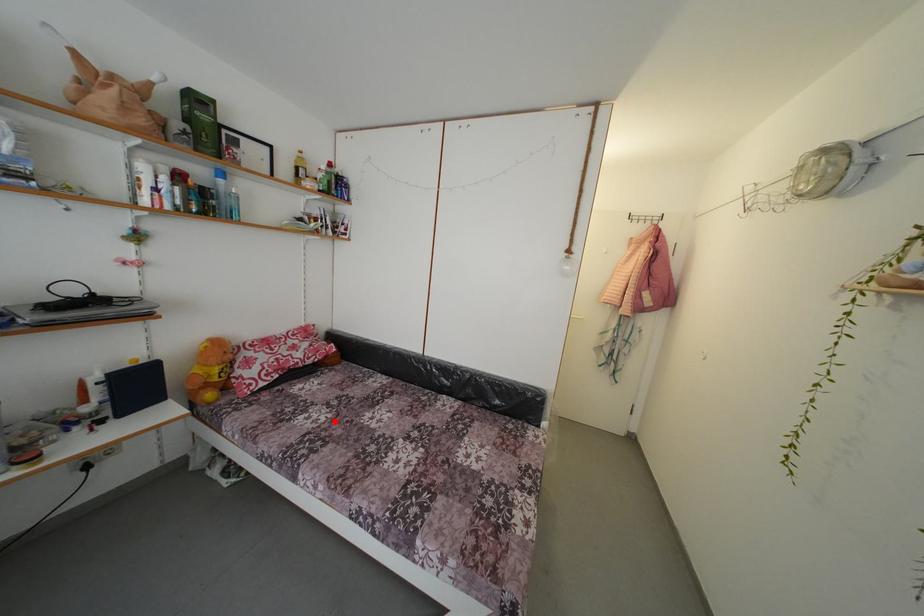
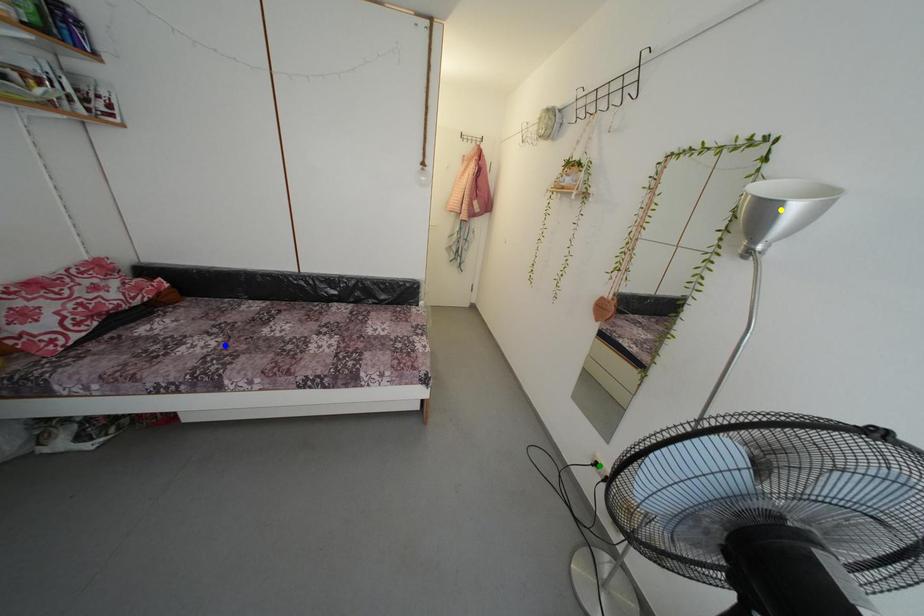
Question: I am providing you with two images of the same scene from different viewpoints. A red point is marked on the first image. You are given multiple points on the second image. Which spot in image 2 lines up with the point in image 1?

Choices:
 (A) blue point
 (B) yellow point
 (C) green point

Answer: (A)